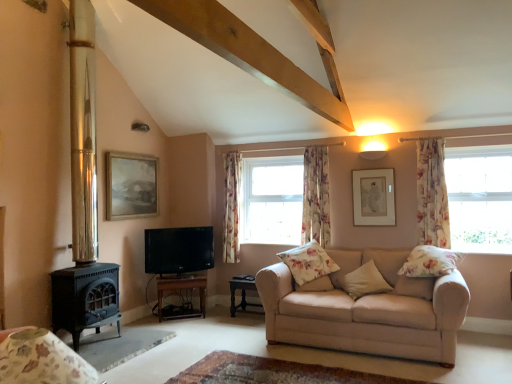
Question: Does floral fabric pillow at right, the fourth pillow when ordered from left to right, lie behind floral fabric curtain at right, the 3th curtain from the left?

Choices:
 (A) yes
 (B) no

Answer: (B)

Question: Can you confirm if floral fabric pillow at right, the first pillow viewed from the right, is positioned to the left of floral fabric curtain at right, which is the 3th curtain in back-to-front order?

Choices:
 (A) no
 (B) yes

Answer: (B)

Question: Is floral fabric pillow at right, the fourth pillow when ordered from left to right, looking in the opposite direction of floral fabric curtain at right, the 1th curtain when ordered from front to back?

Choices:
 (A) yes
 (B) no

Answer: (B)

Question: Can you confirm if floral fabric pillow at right, the fourth pillow when ordered from left to right, is smaller than floral fabric curtain at right, the 3th curtain from the left?

Choices:
 (A) yes
 (B) no

Answer: (B)

Question: Considering the relative sizes of floral fabric pillow at right, the first pillow viewed from the right, and floral fabric curtain at right, the 1th curtain when ordered from front to back, in the image provided, is floral fabric pillow at right, the first pillow viewed from the right, thinner than floral fabric curtain at right, the 1th curtain when ordered from front to back,?

Choices:
 (A) yes
 (B) no

Answer: (B)

Question: Based on their positions, is floral fabric armchair at lower left located to the left or right of floral fabric pillow at right, the fourth pillow when ordered from left to right?

Choices:
 (A) left
 (B) right

Answer: (A)

Question: Is floral fabric armchair at lower left in front of or behind floral fabric pillow at right, the first pillow viewed from the right, in the image?

Choices:
 (A) front
 (B) behind

Answer: (A)

Question: In terms of size, does floral fabric armchair at lower left appear bigger or smaller than floral fabric pillow at right, the fourth pillow when ordered from left to right?

Choices:
 (A) big
 (B) small

Answer: (A)

Question: From the image's perspective, is floral fabric armchair at lower left located above or below floral fabric pillow at right, the fourth pillow when ordered from left to right?

Choices:
 (A) above
 (B) below

Answer: (B)

Question: Looking at their shapes, would you say wooden tv stand at lower center, the 2th table in the right-to-left sequence, is wider or thinner than floral fabric armchair at lower left?

Choices:
 (A) thin
 (B) wide

Answer: (A)

Question: Looking at the image, does wooden tv stand at lower center, the 2th table in the right-to-left sequence, seem bigger or smaller compared to floral fabric armchair at lower left?

Choices:
 (A) small
 (B) big

Answer: (B)

Question: In terms of height, does wooden tv stand at lower center, arranged as the first table when viewed from the left, look taller or shorter compared to floral fabric armchair at lower left?

Choices:
 (A) tall
 (B) short

Answer: (A)

Question: Would you say wooden tv stand at lower center, the 2th table in the right-to-left sequence, is to the left or to the right of floral fabric armchair at lower left in the picture?

Choices:
 (A) left
 (B) right

Answer: (A)

Question: Based on their sizes in the image, would you say polished brass fireplace at left is bigger or smaller than transparent glass window at right?

Choices:
 (A) small
 (B) big

Answer: (B)

Question: Do you think polished brass fireplace at left is within transparent glass window at right, or outside of it?

Choices:
 (A) inside
 (B) outside

Answer: (B)